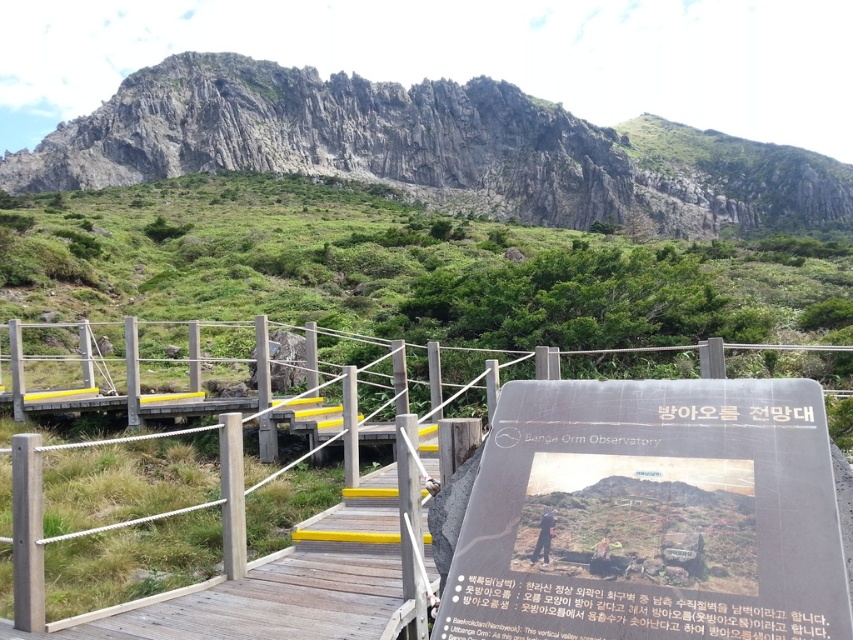
Is rugged stone mountain at upper center wider than wooden rail at center?

Yes, rugged stone mountain at upper center is wider than wooden rail at center.

This screenshot has height=640, width=853. What do you see at coordinates (434, 148) in the screenshot?
I see `rugged stone mountain at upper center` at bounding box center [434, 148].

What are the coordinates of `rugged stone mountain at upper center` in the screenshot? It's located at (434, 148).

Consider the image. Which of these two, black plastic sign at center or rugged stone mountain at upper center, stands taller?

With more height is rugged stone mountain at upper center.

Does point (489, 484) lie behind point (132, 84)?

No, (489, 484) is closer to viewer.

The image size is (853, 640). What are the coordinates of `black plastic sign at center` in the screenshot? It's located at (650, 515).

Which is above, black plastic sign at center or wooden rail at center?

wooden rail at center is above.

Can you confirm if black plastic sign at center is positioned above wooden rail at center?

No.

Which is in front, point (572, 630) or point (236, 564)?

Point (572, 630) is more forward.

Locate an element on the screen. black plastic sign at center is located at coordinates (650, 515).